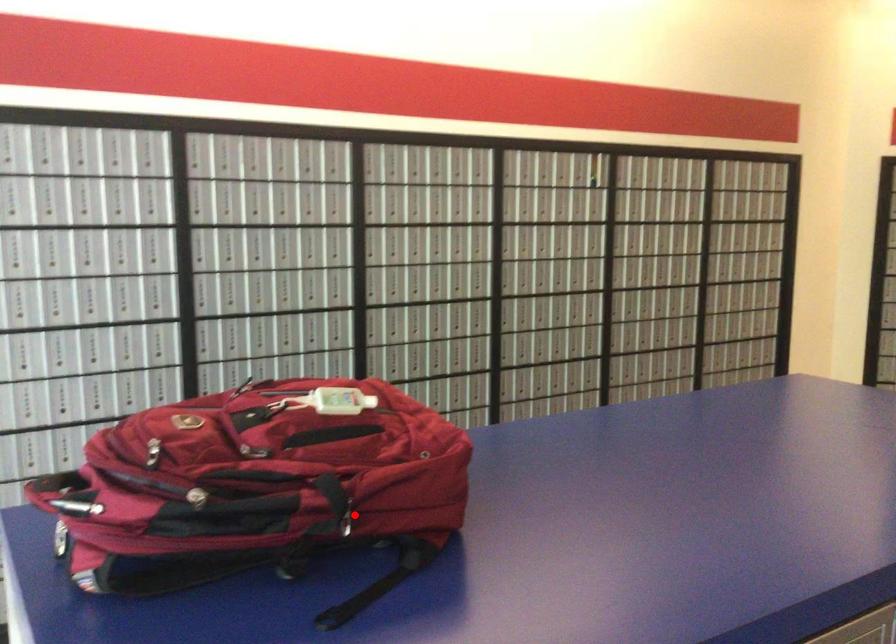
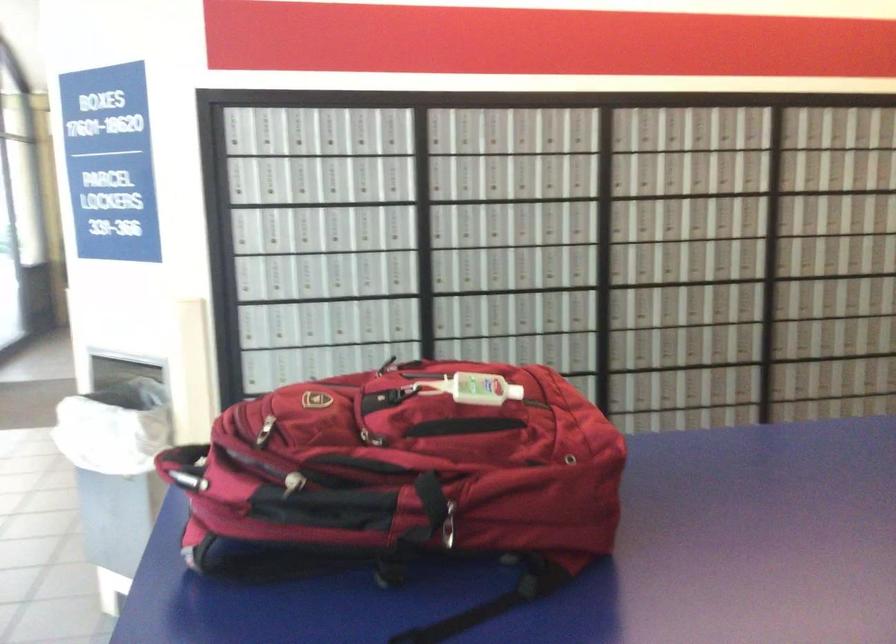
Question: I am providing you with two images of the same scene from different viewpoints. In image1, a red point is highlighted. Considering the same 3D point in image2, which of the following is correct?

Choices:
 (A) It is closer
 (B) It is farther

Answer: (A)